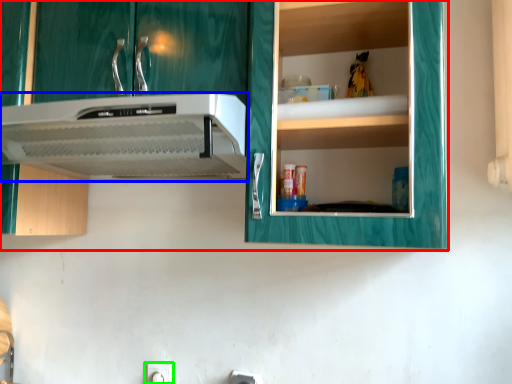
Question: Which object is the closest to the cabinetry (highlighted by a red box)? Choose among these: home appliance (highlighted by a blue box) or electric outlet (highlighted by a green box).

Choices:
 (A) home appliance
 (B) electric outlet

Answer: (A)